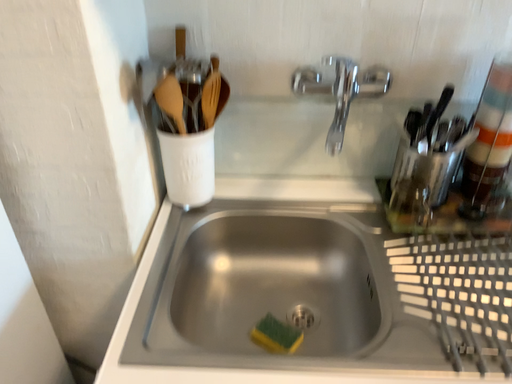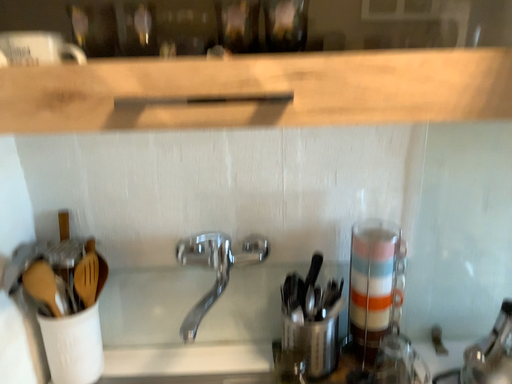
Question: Which way did the camera rotate in the video?

Choices:
 (A) rotated upward
 (B) rotated downward

Answer: (A)